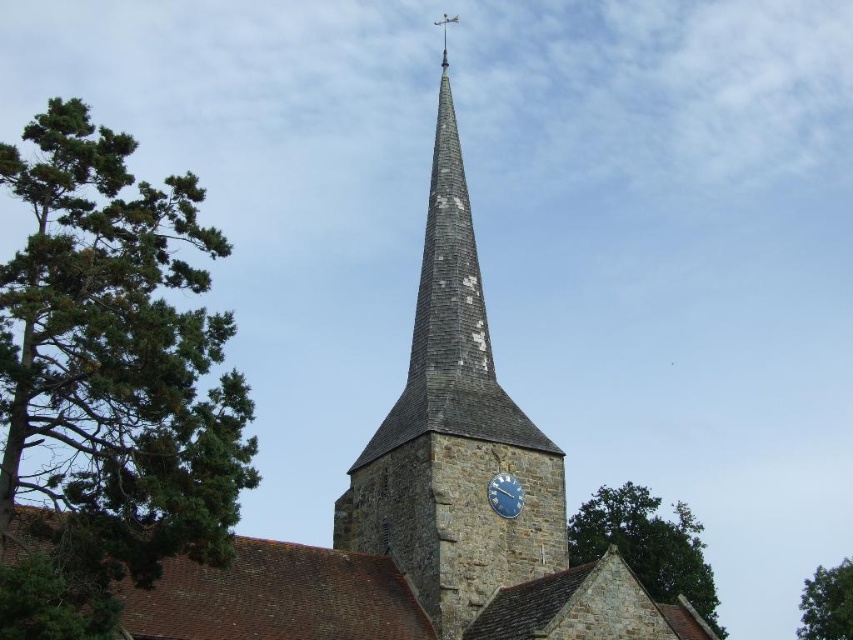
Question: Which object is the farthest from the blue metallic clock at center?

Choices:
 (A) green leafy tree at lower right
 (B) stone clock tower at center
 (C) green needle-like leaves at left

Answer: (A)

Question: Which point is farther to the camera?

Choices:
 (A) green leafy tree at lower right
 (B) green leafy tree at upper center

Answer: (B)

Question: Which point is farther to the camera?

Choices:
 (A) stone clock tower at center
 (B) green leafy tree at upper center
 (C) green needle-like leaves at left
 (D) blue metallic clock at center

Answer: (B)

Question: Is stone clock tower at center in front of green leafy tree at lower right?

Choices:
 (A) no
 (B) yes

Answer: (B)

Question: In this image, where is green needle-like leaves at left located relative to green leafy tree at lower right?

Choices:
 (A) below
 (B) above

Answer: (B)

Question: Is green leafy tree at upper center below blue metallic clock at center?

Choices:
 (A) yes
 (B) no

Answer: (A)